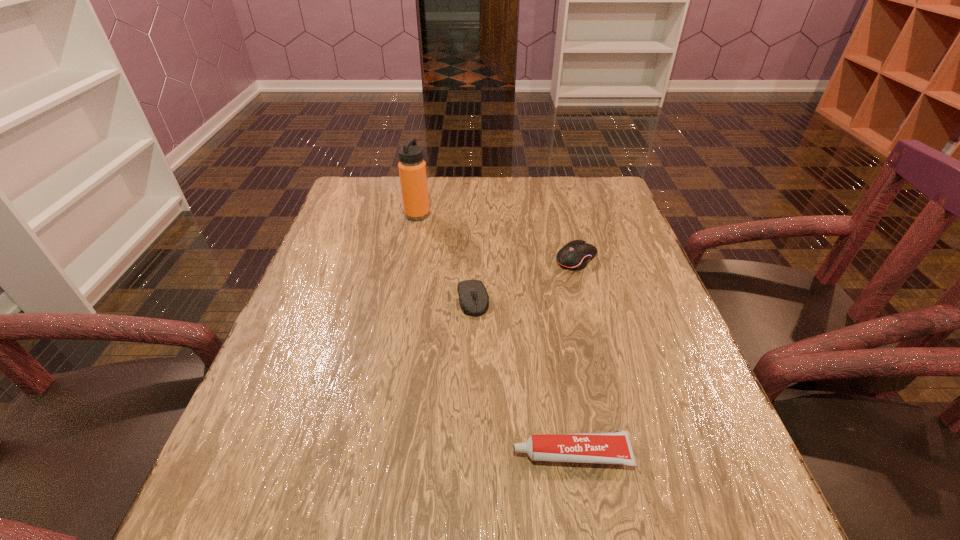
You are a GUI agent. You are given a task and a screenshot of the screen. Output one action in this format:
    pyautogui.click(x=<x>, y=<y>)
    Task: Click on the farthest object
    This screenshot has height=540, width=960.
    Given the screenshot: What is the action you would take?
    pyautogui.click(x=412, y=168)

Where is `the leftmost object`? This screenshot has width=960, height=540. the leftmost object is located at coordinates (412, 168).

Locate an element on the screen. the second tallest object is located at coordinates click(x=576, y=254).

This screenshot has width=960, height=540. In order to click on the right computer equipment in this screenshot , I will do `click(576, 254)`.

At what (x,y) coordinates should I click in order to perform the action: click on the nearest object. Please return your answer as a coordinate pair (x, y). Looking at the image, I should click on (605, 447).

At what (x,y) coordinates should I click in order to perform the action: click on the left computer equipment. Please return your answer as a coordinate pair (x, y). Looking at the image, I should click on (466, 289).

Identify the location of the third farthest object. (466, 289).

Where is `free space located on the right of the tallest object`? This screenshot has height=540, width=960. free space located on the right of the tallest object is located at coordinates (451, 214).

At what (x,y) coordinates should I click in order to perform the action: click on free space located on the right of the second farthest object. Please return your answer as a coordinate pair (x, y). The height and width of the screenshot is (540, 960). Looking at the image, I should click on (622, 258).

Locate an element on the screen. This screenshot has height=540, width=960. free region located at the nozzle of the toothpaste is located at coordinates pos(353,454).